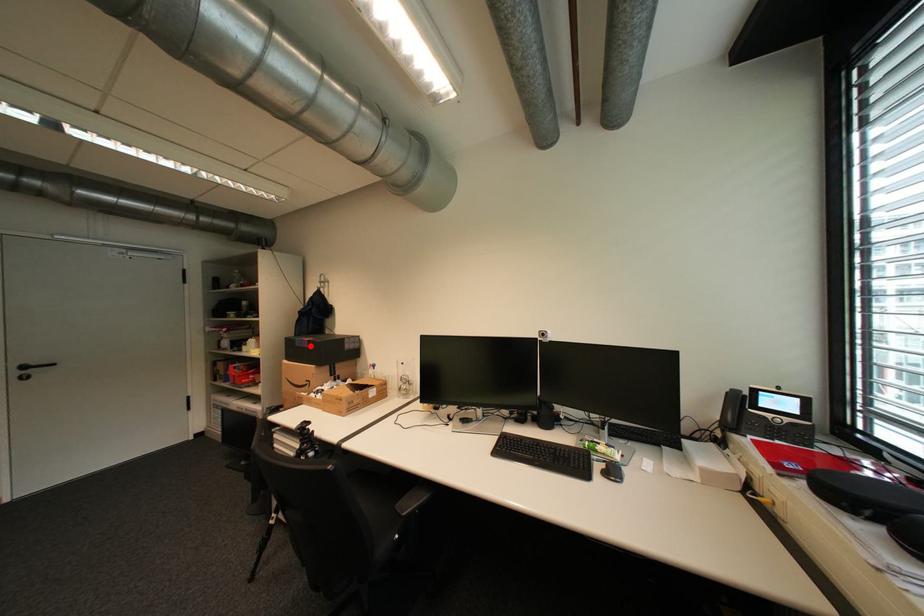
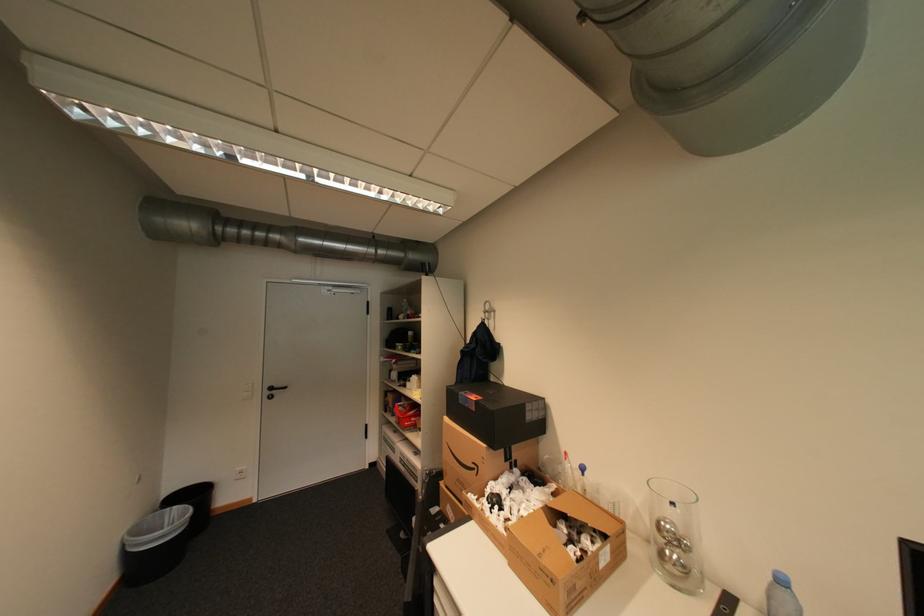
Where in the second image is the point corresponding to the highlighted location from the first image?

(476, 406)